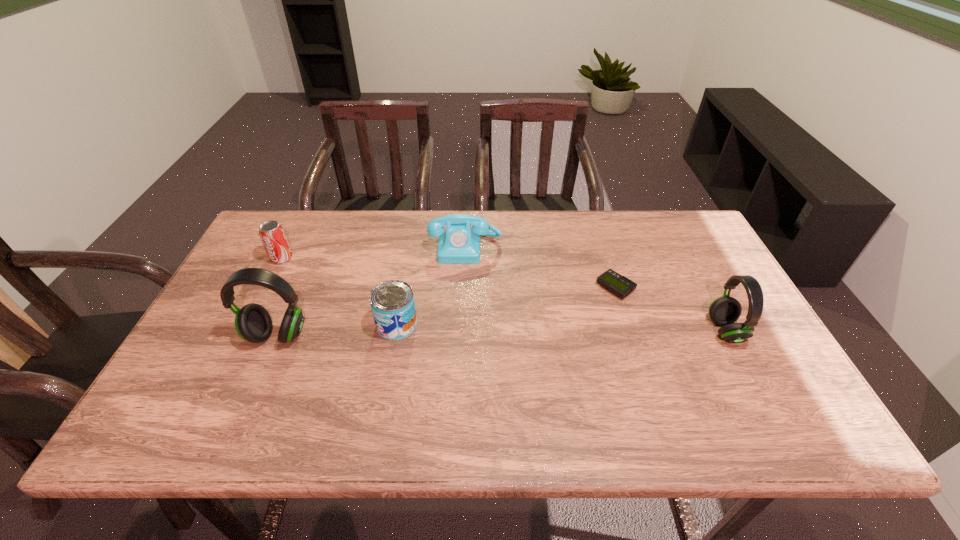
What are the coordinates of `vacant space situated 0.130m on the right of the soda can` in the screenshot? It's located at (336, 258).

The width and height of the screenshot is (960, 540). Identify the location of vacant space located on the right of the shortest object. (708, 288).

You are a GUI agent. You are given a task and a screenshot of the screen. Output one action in this format:
    pyautogui.click(x=<x>, y=<y>)
    Task: Click on the vacant region located on the dial of the telephone
    
    Given the screenshot: What is the action you would take?
    pyautogui.click(x=463, y=311)

You are a GUI agent. You are given a task and a screenshot of the screen. Output one action in this format:
    pyautogui.click(x=<x>, y=<y>)
    Task: Click on the vacant space situated 0.190m on the back of the can
    
    Given the screenshot: What is the action you would take?
    pyautogui.click(x=408, y=264)

This screenshot has height=540, width=960. Find the location of `soda can that is at the far edge`. soda can that is at the far edge is located at coordinates (273, 237).

I want to click on telephone that is positioned at the far edge, so click(460, 244).

You are a GUI agent. You are given a task and a screenshot of the screen. Output one action in this format:
    pyautogui.click(x=<x>, y=<y>)
    Task: Click on the headset present at the left edge
    The width and height of the screenshot is (960, 540).
    Given the screenshot: What is the action you would take?
    pyautogui.click(x=253, y=323)

What are the coordinates of `soda can positioned at the left edge` in the screenshot? It's located at (273, 237).

The image size is (960, 540). What are the coordinates of `object at the right edge` in the screenshot? It's located at [x=724, y=311].

The image size is (960, 540). What are the coordinates of `object present at the far left corner` in the screenshot? It's located at (273, 237).